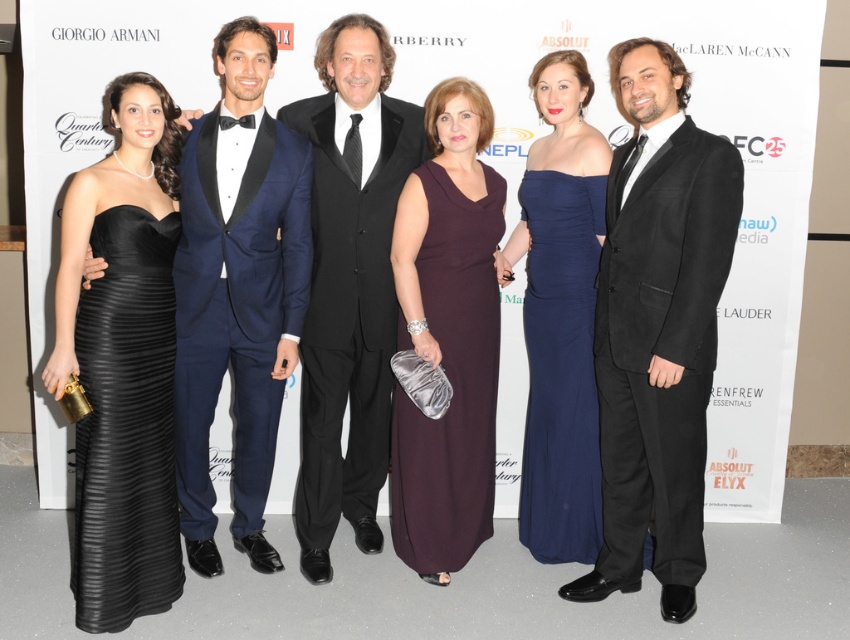
Does black suede suit at center appear on the right side of dark purple satin dress at center?

Correct, you'll find black suede suit at center to the right of dark purple satin dress at center.

Who is more forward, (627, 424) or (484, 404)?

Positioned in front is point (627, 424).

Which is in front, point (677, 388) or point (418, 244)?

Point (677, 388) is more forward.

The width and height of the screenshot is (850, 640). In order to click on black suede suit at center in this screenshot , I will do `click(658, 328)`.

Which is more to the left, black suede suit at center or navy satin dress at center?

navy satin dress at center

Where is `black suede suit at center`? The image size is (850, 640). black suede suit at center is located at coordinates (658, 328).

Who is more forward, [630,408] or [578,241]?

Point [630,408]

The image size is (850, 640). What are the coordinates of `black suede suit at center` in the screenshot? It's located at (658, 328).

Measure the distance from black pleated dress at left to dark purple satin dress at center.

A distance of 39.32 inches exists between black pleated dress at left and dark purple satin dress at center.

Does black pleated dress at left lie in front of dark purple satin dress at center?

Yes, black pleated dress at left is in front of dark purple satin dress at center.

Who is more forward, (165, 534) or (415, 268)?

Positioned in front is point (165, 534).

The image size is (850, 640). Find the location of `black pleated dress at left`. black pleated dress at left is located at coordinates point(126,426).